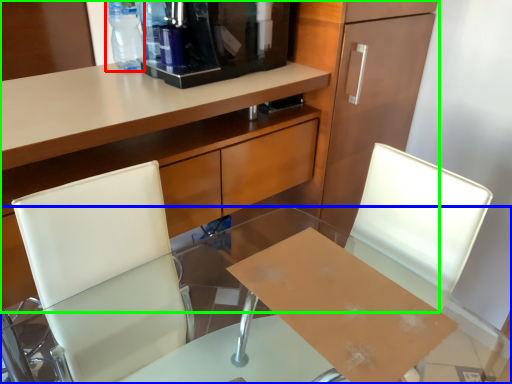
Question: Which object is the closest to the bottle (highlighted by a red box)? Choose among these: desk (highlighted by a blue box) or cabinetry (highlighted by a green box).

Choices:
 (A) desk
 (B) cabinetry

Answer: (B)